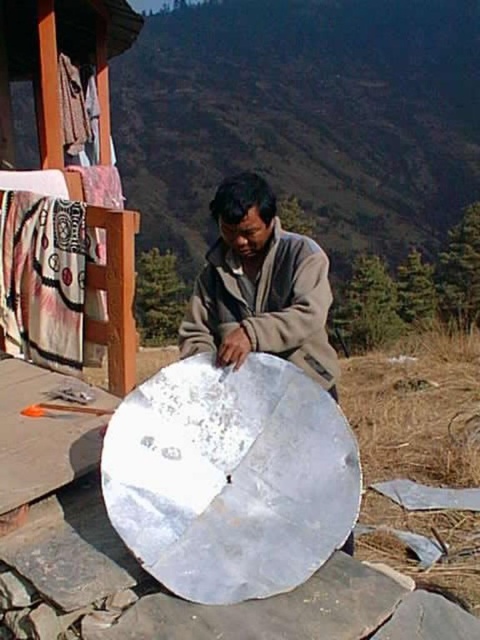
You are a photographer trying to capture the matte gray jacket at center and the white woven cloth at upper left in a single shot. Which object will appear larger in the photo?

The matte gray jacket at center will appear larger in the photo because it is closer to the viewer than the white woven cloth at upper left.

You are standing in the rustic elevated area where the man is working. You need to place a small tool on the surface where the matte gray jacket at center is located. Will the white woven cloth at upper left be in the way?

The matte gray jacket at center is below the white woven cloth at upper left, so the white woven cloth at upper left is above the jacket. Since the jacket is on the work surface, the cloth is likely hanging above it and not directly obstructing the surface. Therefore, placing the tool there should be possible without the cloth being in the way.

You are standing in the scene and want to place a small tool on the closest point to you between point A at point (240, 316) and point B at point (27, 340). Which point should you choose?

You should choose point A at point (240, 316) because it is closer to the camera than point B at point (27, 340).